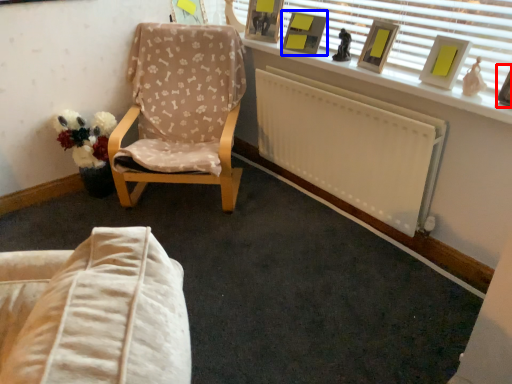
Question: Which of the following is the closest to the observer, picture frame (highlighted by a red box) or picture frame (highlighted by a blue box)?

Choices:
 (A) picture frame
 (B) picture frame

Answer: (A)